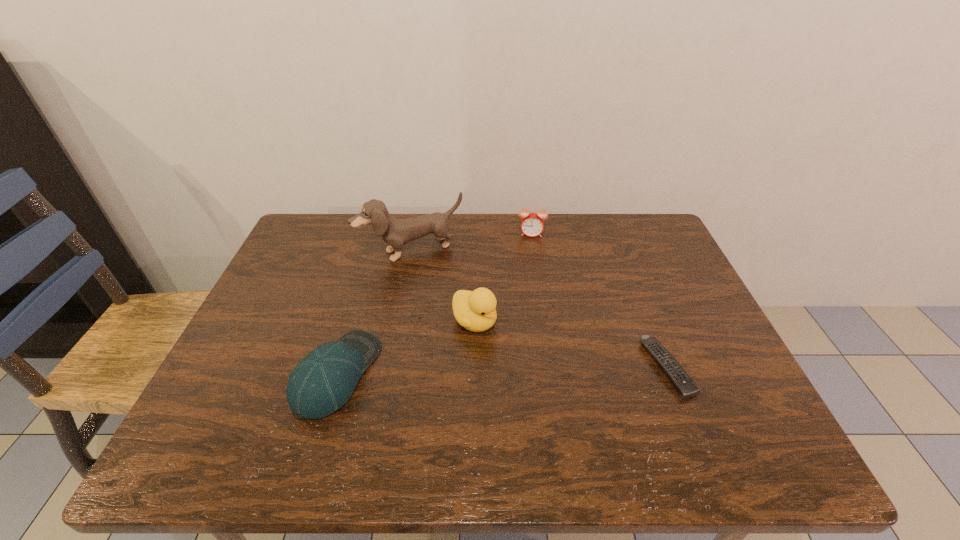
You are a GUI agent. You are given a task and a screenshot of the screen. Output one action in this format:
    pyautogui.click(x=<x>, y=<y>)
    Task: Click on the second shortest object
    Image resolution: width=960 pixels, height=540 pixels.
    Given the screenshot: What is the action you would take?
    pyautogui.click(x=323, y=381)

Find the location of a particular element. remote control is located at coordinates (685, 386).

Identify the location of the shortest object. The height and width of the screenshot is (540, 960). (685, 386).

Locate an element on the screen. The image size is (960, 540). the tallest object is located at coordinates (396, 232).

You are a GUI agent. You are given a task and a screenshot of the screen. Output one action in this format:
    pyautogui.click(x=<x>, y=<y>)
    Task: Click on the duck
    
    Given the screenshot: What is the action you would take?
    pyautogui.click(x=475, y=310)

The image size is (960, 540). What are the coordinates of `alarm clock` in the screenshot? It's located at (532, 225).

Where is `vacant area situated on the left of the second shortest object`? The height and width of the screenshot is (540, 960). vacant area situated on the left of the second shortest object is located at coordinates (228, 374).

At what (x,y) coordinates should I click in order to perform the action: click on blank space located 0.330m on the back of the shortest object. Please return your answer as a coordinate pair (x, y). The height and width of the screenshot is (540, 960). Looking at the image, I should click on (623, 255).

Where is `free point located at the face of the puppy`? The width and height of the screenshot is (960, 540). free point located at the face of the puppy is located at coordinates (452, 309).

I want to click on free space located 0.320m at the face of the puppy, so pos(469,342).